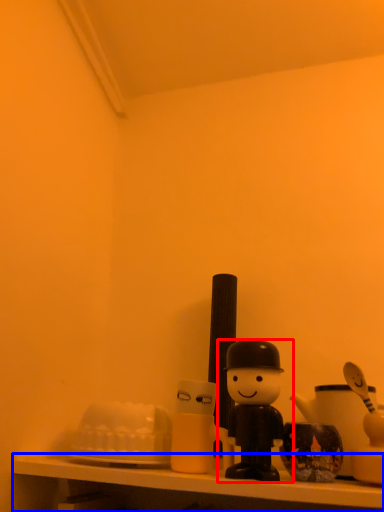
Question: Among these objects, which one is farthest to the camera, toy (highlighted by a red box) or shelf (highlighted by a blue box)?

Choices:
 (A) toy
 (B) shelf

Answer: (A)